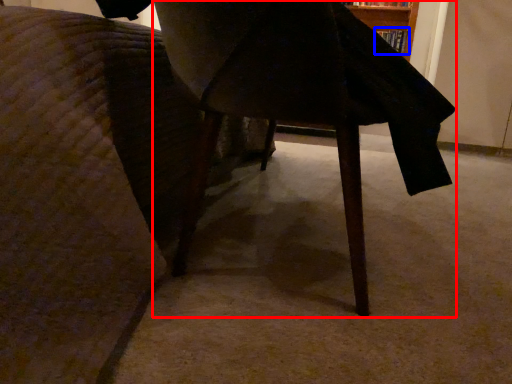
Question: Which point is closer to the camera, table (highlighted by a red box) or book (highlighted by a blue box)?

Choices:
 (A) table
 (B) book

Answer: (A)